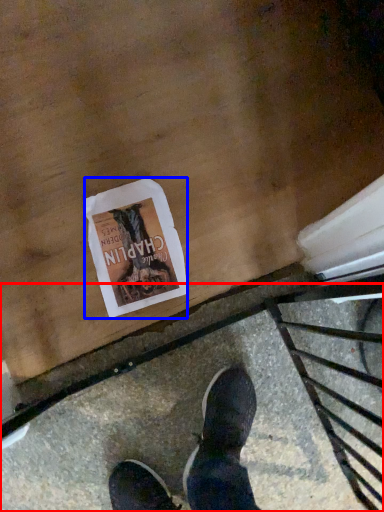
Question: Among these objects, which one is farthest to the camera, pavement (highlighted by a red box) or flyer (highlighted by a blue box)?

Choices:
 (A) pavement
 (B) flyer

Answer: (B)